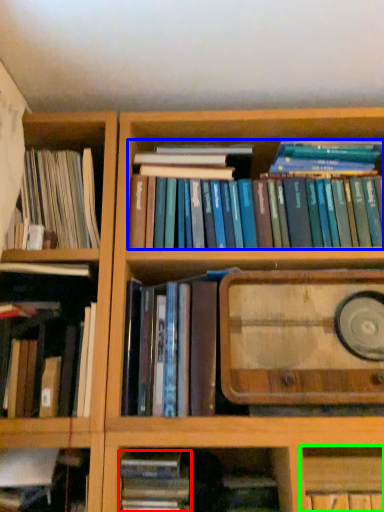
Question: Considering the real-world distances, which object is farthest from book (highlighted by a red box)? book (highlighted by a blue box) or cabinet (highlighted by a green box)?

Choices:
 (A) book
 (B) cabinet

Answer: (A)